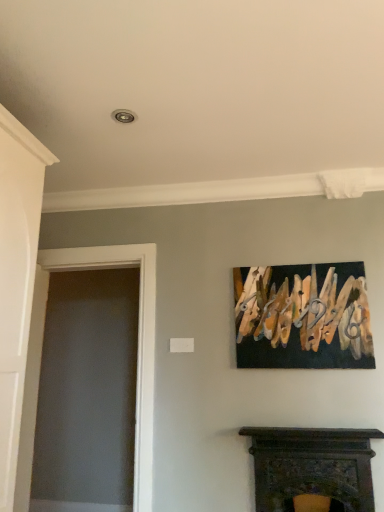
Question: From a real-world perspective, is transparent glass door at left beneath white painted wood door at left?

Choices:
 (A) yes
 (B) no

Answer: (B)

Question: Does transparent glass door at left have a lesser height compared to white painted wood door at left?

Choices:
 (A) no
 (B) yes

Answer: (A)

Question: Is the depth of transparent glass door at left less than that of white painted wood door at left?

Choices:
 (A) no
 (B) yes

Answer: (A)

Question: Is the depth of transparent glass door at left greater than that of white painted wood door at left?

Choices:
 (A) yes
 (B) no

Answer: (A)

Question: Is transparent glass door at left positioned beyond the bounds of white painted wood door at left?

Choices:
 (A) yes
 (B) no

Answer: (A)

Question: From a real-world perspective, is transparent glass door at left above or below wooden clothespins at upper right?

Choices:
 (A) below
 (B) above

Answer: (A)

Question: Is transparent glass door at left taller or shorter than wooden clothespins at upper right?

Choices:
 (A) tall
 (B) short

Answer: (A)

Question: Would you say transparent glass door at left is inside or outside wooden clothespins at upper right?

Choices:
 (A) outside
 (B) inside

Answer: (A)

Question: Is point (48, 270) positioned closer to the camera than point (337, 362)?

Choices:
 (A) farther
 (B) closer

Answer: (A)

Question: From a real-world perspective, is wooden clothespins at upper right positioned above or below dark wood fireplace at lower center?

Choices:
 (A) above
 (B) below

Answer: (A)

Question: Considering their positions, is wooden clothespins at upper right located in front of or behind dark wood fireplace at lower center?

Choices:
 (A) front
 (B) behind

Answer: (B)

Question: Is point (238, 304) closer or farther from the camera than point (339, 485)?

Choices:
 (A) farther
 (B) closer

Answer: (A)

Question: In terms of size, does wooden clothespins at upper right appear bigger or smaller than dark wood fireplace at lower center?

Choices:
 (A) big
 (B) small

Answer: (B)

Question: Is wooden clothespins at upper right inside or outside of white painted wood door at left?

Choices:
 (A) inside
 (B) outside

Answer: (B)

Question: Would you say wooden clothespins at upper right is to the left or to the right of white painted wood door at left in the picture?

Choices:
 (A) right
 (B) left

Answer: (A)